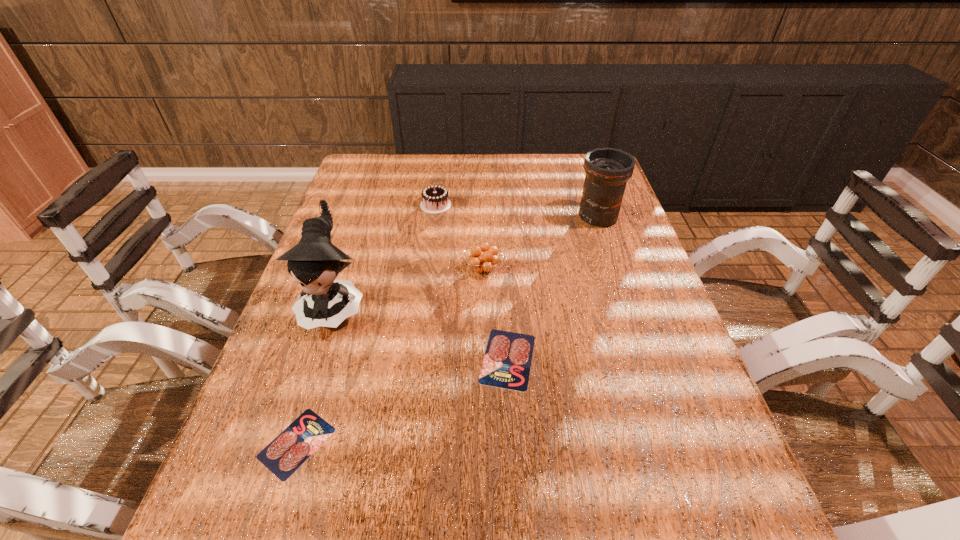
At what (x,y) coordinates should I click in order to perform the action: click on vacant area situated on the left of the taller salami. Please return your answer as a coordinate pair (x, y). Image resolution: width=960 pixels, height=540 pixels. Looking at the image, I should click on (418, 359).

Locate an element on the screen. free location located 0.240m on the front of the third object from left to right is located at coordinates (428, 266).

Locate an element on the screen. free space located at the face of the doll is located at coordinates (277, 476).

The height and width of the screenshot is (540, 960). I want to click on vacant area situated on the front of the orange fruit, so click(x=484, y=424).

Locate an element on the screen. vacant space located on the back of the second tallest object is located at coordinates (580, 164).

The height and width of the screenshot is (540, 960). In order to click on object that is at the near edge in this screenshot , I will do `click(292, 447)`.

Find the location of a particular element. The image size is (960, 540). salami that is at the left edge is located at coordinates (292, 447).

Image resolution: width=960 pixels, height=540 pixels. I want to click on doll that is at the left edge, so click(314, 263).

Where is `object situated at the right edge`? object situated at the right edge is located at coordinates (607, 170).

In order to click on object situated at the near left corner in this screenshot , I will do `click(292, 447)`.